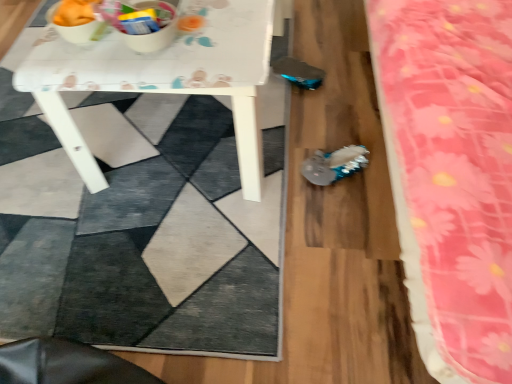
Locate an element on the screen. The height and width of the screenshot is (384, 512). vacant area located to the right-hand side of shiny metallic shoe at center is located at coordinates (373, 157).